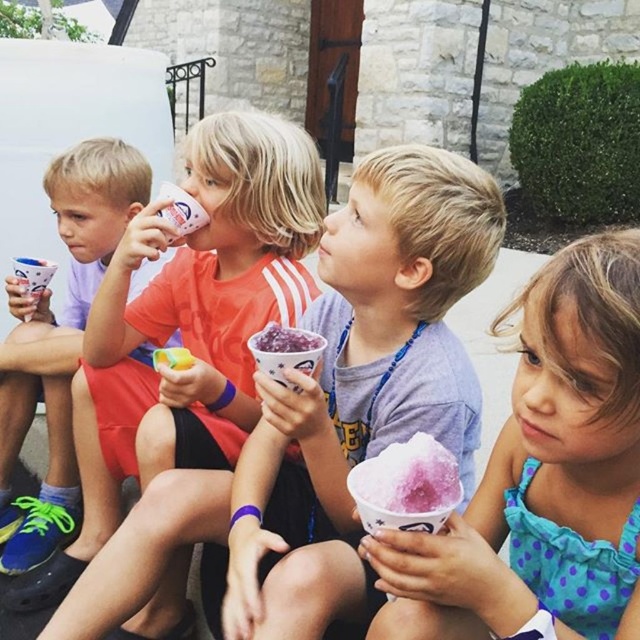
Question: Among these objects, which one is nearest to the camera?

Choices:
 (A) matte plastic cup at center
 (B) matte white cup at left

Answer: (A)

Question: Which object is positioned farthest from the matte white cup at left?

Choices:
 (A) matte plastic cup at center
 (B) pink frosted snow cone at center

Answer: (B)

Question: From the image, what is the correct spatial relationship of pink frosted snow cone at center in relation to matte plastic cup at center?

Choices:
 (A) above
 (B) below

Answer: (B)

Question: Is matte plastic cup at center smaller than matte white cup at left?

Choices:
 (A) yes
 (B) no

Answer: (B)

Question: In this image, where is pink frosted snow cone at center located relative to matte plastic cup at center?

Choices:
 (A) left
 (B) right

Answer: (B)

Question: Among these objects, which one is farthest from the camera?

Choices:
 (A) matte white cup at left
 (B) matte plastic cup at center
 (C) pink frosted snow cone at center

Answer: (A)